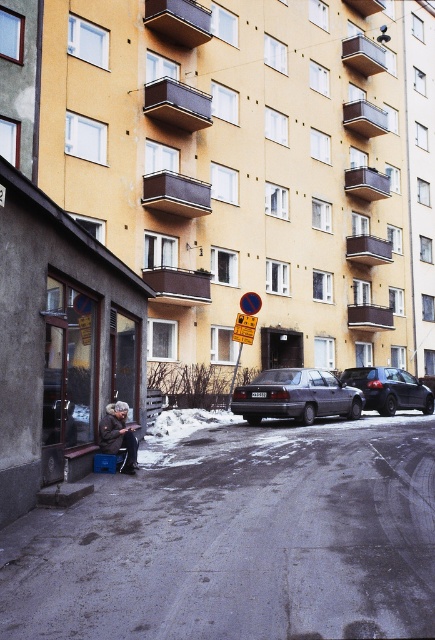
Question: Is dark blue metallic car at center-right to the left of metallic circular sign at center from the viewer's perspective?

Choices:
 (A) no
 (B) yes

Answer: (A)

Question: Is dark blue metallic car at center-right smaller than metallic circular sign at center?

Choices:
 (A) yes
 (B) no

Answer: (A)

Question: Which point is closer to the camera?

Choices:
 (A) matte gray sedan at center
 (B) dark blue metallic car at center-right
 (C) metallic circular sign at center

Answer: (A)

Question: Which object is positioned farthest from the dark blue metallic car at center-right?

Choices:
 (A) gray woolen coat at lower left
 (B) metallic reflective sign at center
 (C) matte gray sedan at center
 (D) metallic circular sign at center

Answer: (A)

Question: Does metallic reflective sign at center have a larger size compared to metallic circular sign at center?

Choices:
 (A) yes
 (B) no

Answer: (B)

Question: Which point appears farthest from the camera in this image?

Choices:
 (A) (384, 384)
 (B) (240, 406)

Answer: (A)